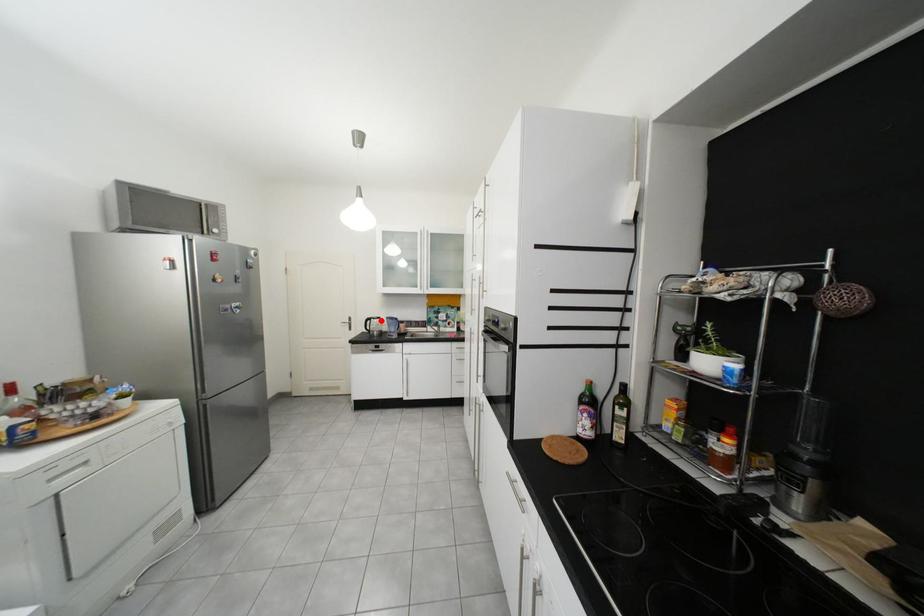
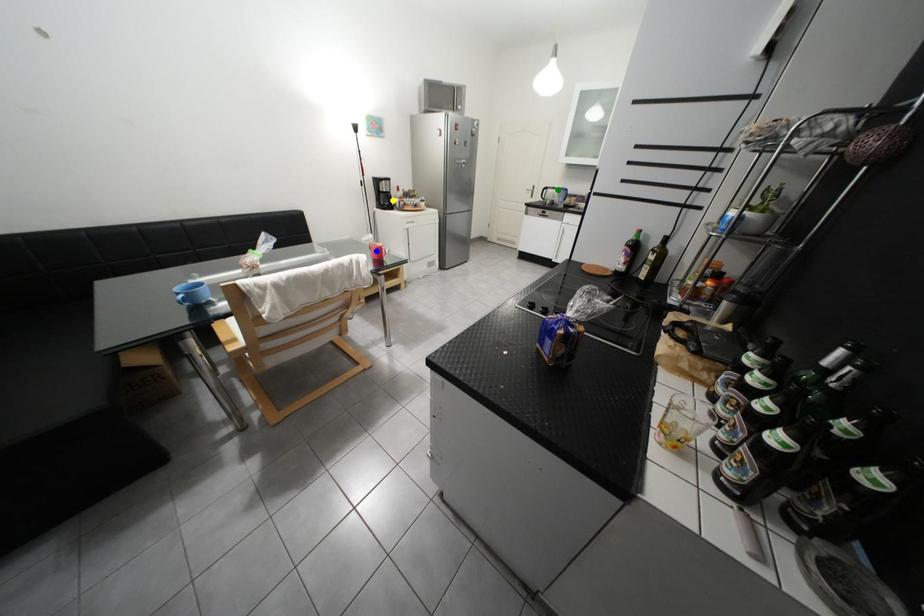
Question: I am providing you with two images of the same scene from different viewpoints. A red point is marked on the first image. You are given multiple points on the second image. Which point in image 2 is actually the same real-world point as the red point in image 1?

Choices:
 (A) green point
 (B) yellow point
 (C) blue point

Answer: (A)